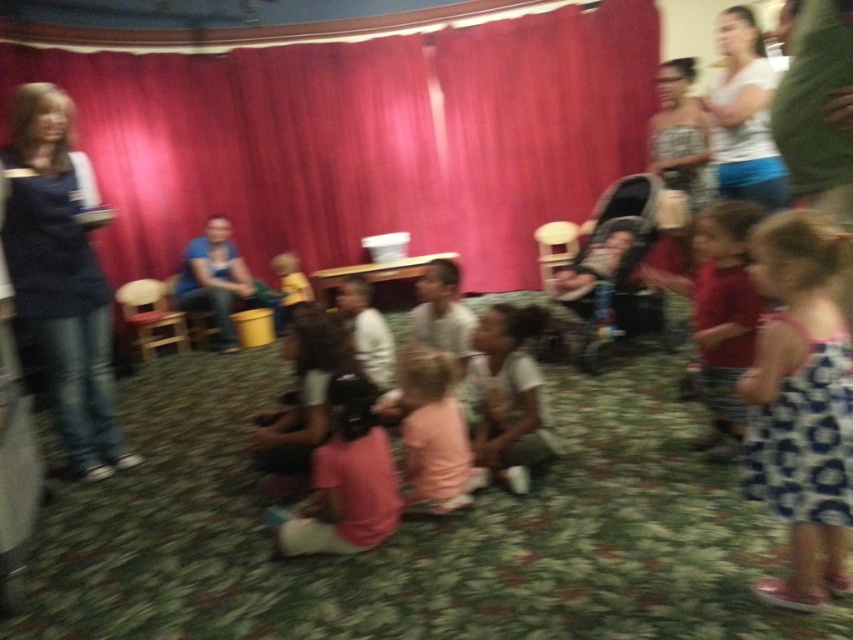
In the scene shown: Who is taller, red velvet curtain at upper center or pink fabric at center?

red velvet curtain at upper center is taller.

Measure the distance between red velvet curtain at upper center and pink fabric at center.

The distance of red velvet curtain at upper center from pink fabric at center is 4.58 meters.

You are a GUI agent. You are given a task and a screenshot of the screen. Output one action in this format:
    pyautogui.click(x=<x>, y=<y>)
    Task: Click on the red velvet curtain at upper center
    The height and width of the screenshot is (640, 853).
    Given the screenshot: What is the action you would take?
    pyautogui.click(x=363, y=138)

Image resolution: width=853 pixels, height=640 pixels. In order to click on red velvet curtain at upper center in this screenshot , I will do `click(363, 138)`.

In order to click on white matte shirt at center in this screenshot , I will do `click(508, 396)`.

Who is more distant from viewer, (x=505, y=417) or (x=456, y=484)?

The point (x=505, y=417) is behind.

The width and height of the screenshot is (853, 640). In order to click on white matte shirt at center in this screenshot , I will do `click(508, 396)`.

The height and width of the screenshot is (640, 853). In order to click on white matte shirt at center in this screenshot , I will do `click(508, 396)`.

Can you confirm if red velvet curtain at upper center is wider than blue denim jeans at left?

Indeed, red velvet curtain at upper center has a greater width compared to blue denim jeans at left.

Locate an element on the screen. Image resolution: width=853 pixels, height=640 pixels. red velvet curtain at upper center is located at coordinates (363, 138).